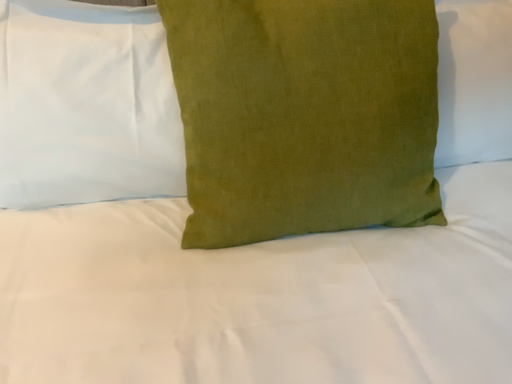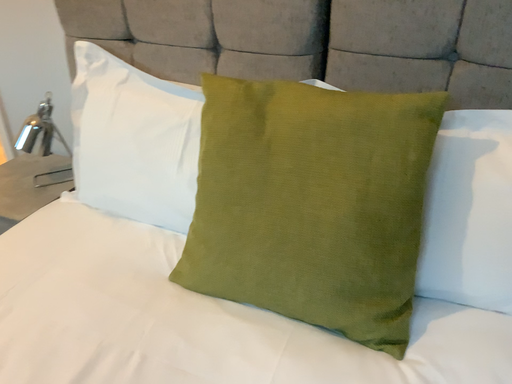
Question: How did the camera likely rotate when shooting the video?

Choices:
 (A) rotated upward
 (B) rotated downward

Answer: (A)